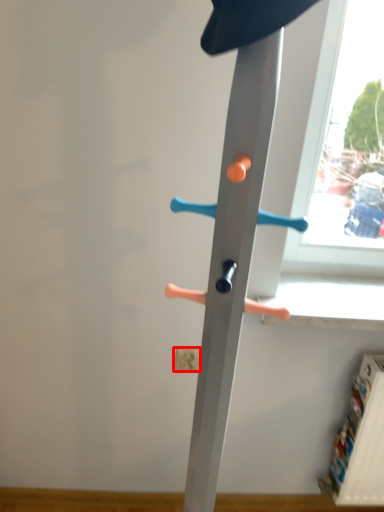
Question: Where is electric outlet (annotated by the red box) located in relation to furniture in the image?

Choices:
 (A) right
 (B) left

Answer: (B)